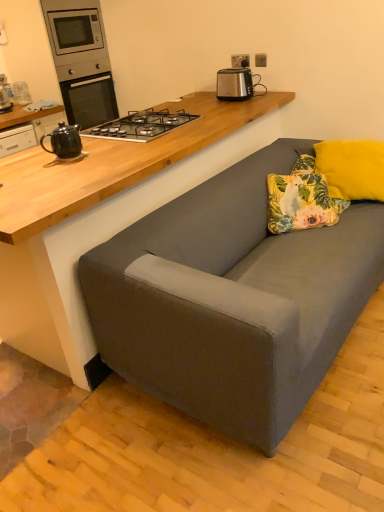
Locate an element on the screen. free space in front of black ceramic teapot at left is located at coordinates (59, 168).